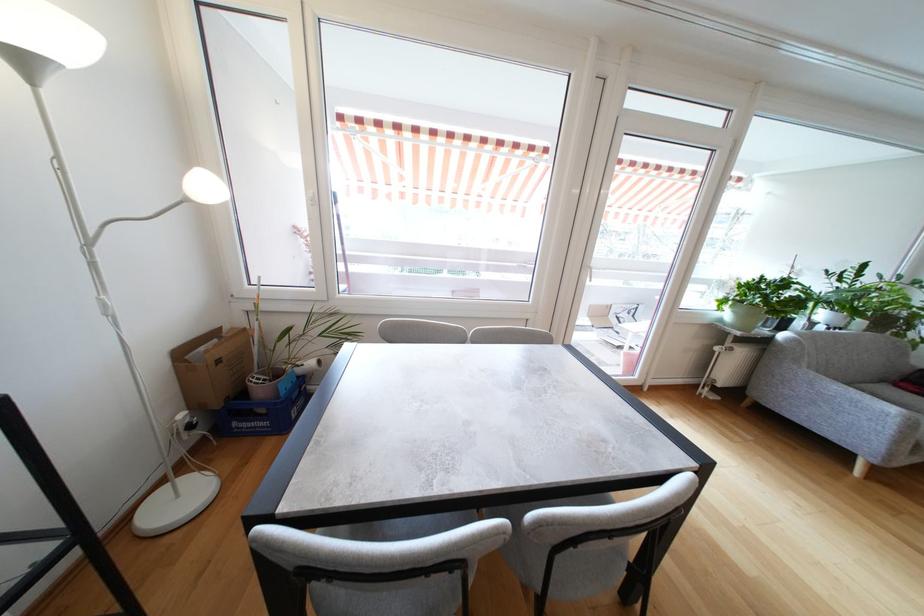
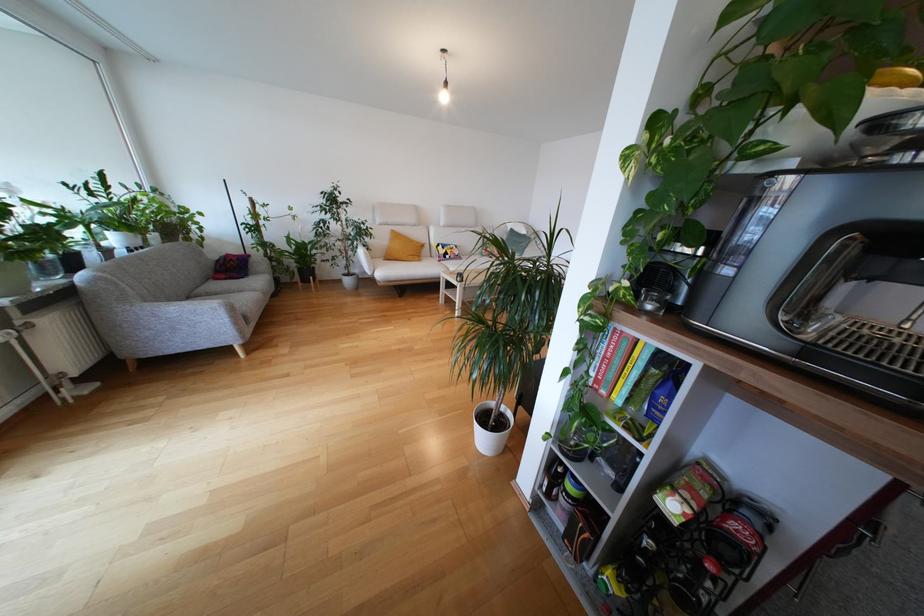
The point at (x=866, y=387) is marked in the first image. Where is the corresponding point in the second image?

(201, 292)